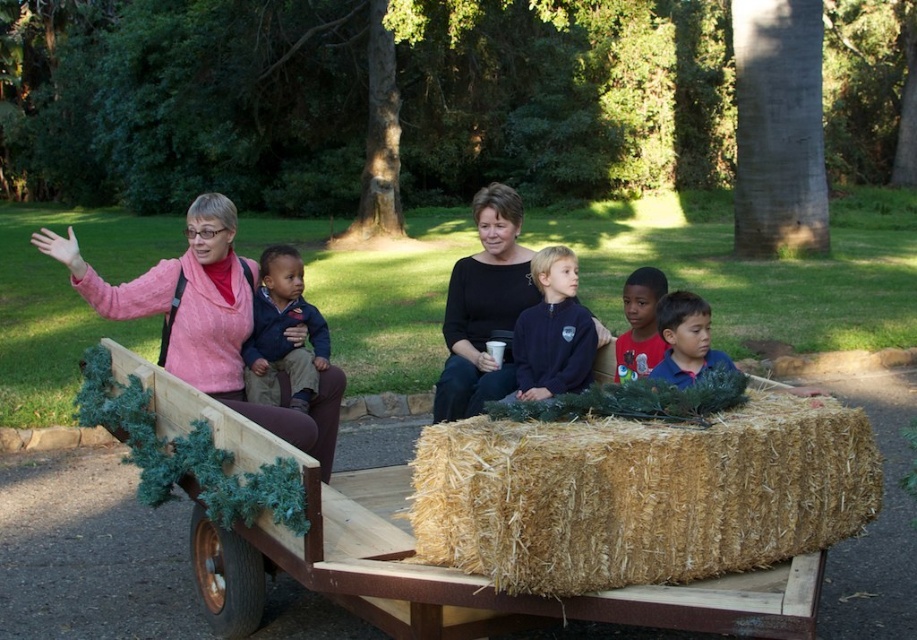
You are standing in the park and see the wooden wagon at center and the black matte sweater at center. Which object is closer to you?

The wooden wagon at center is closer to you because it is in front of the black matte sweater at center.